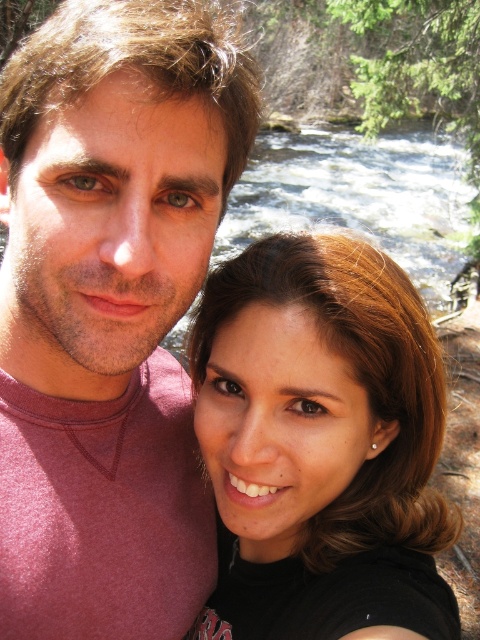
Is matte pink shirt at center taller than matte black hair at center?

Correct, matte pink shirt at center is much taller as matte black hair at center.

The image size is (480, 640). Describe the element at coordinates (109, 310) in the screenshot. I see `matte pink shirt at center` at that location.

Find the location of `matte pink shirt at center`. matte pink shirt at center is located at coordinates (109, 310).